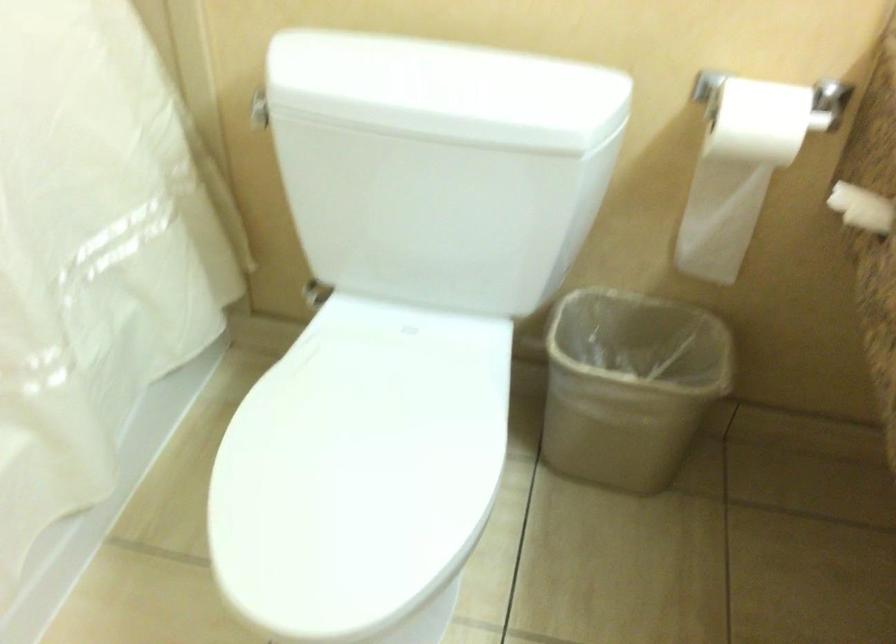
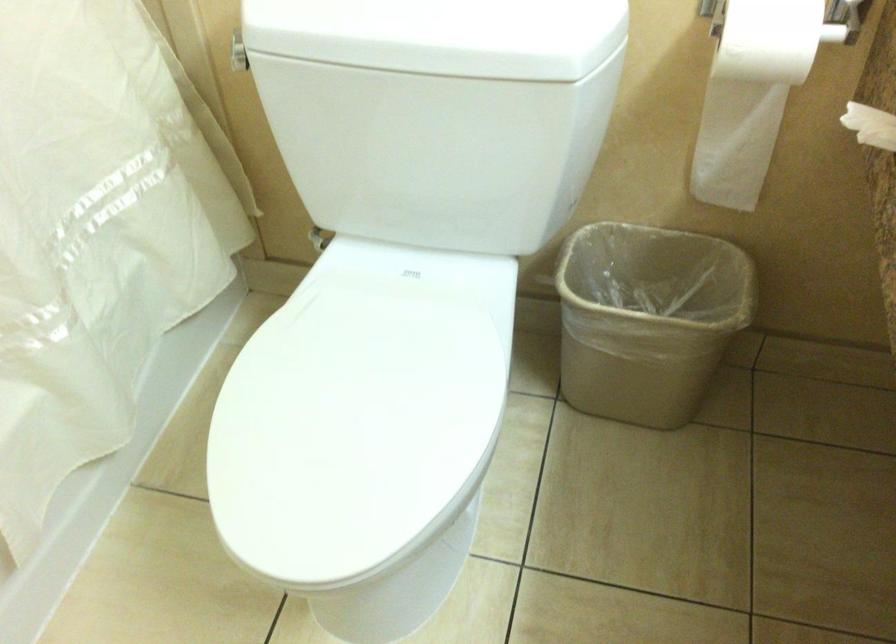
In the second image, find the point that corresponds to [635,383] in the first image.

(647, 319)